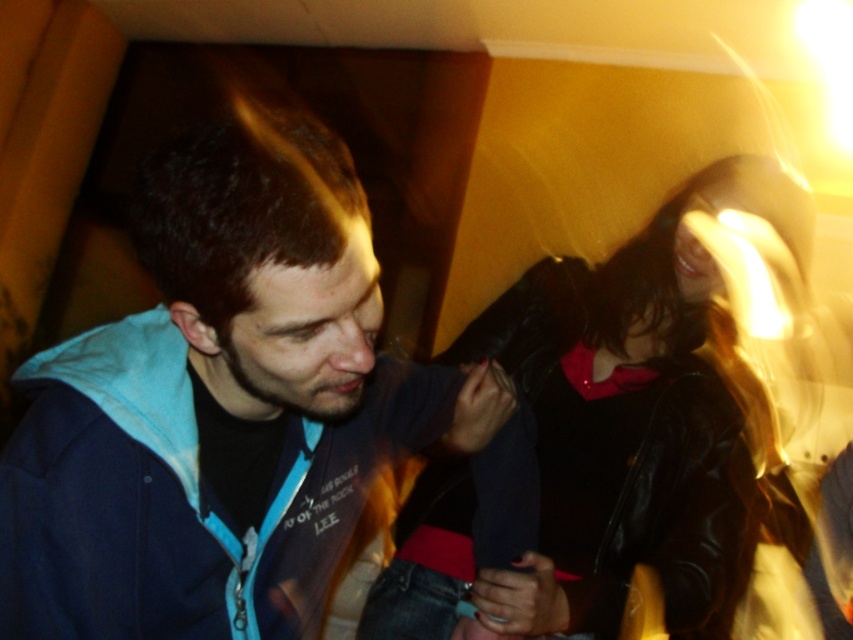
Can you confirm if blue zip-up hoodie at center is positioned to the right of shiny black jacket at center?

Incorrect, blue zip-up hoodie at center is not on the right side of shiny black jacket at center.

Can you confirm if blue zip-up hoodie at center is positioned below shiny black jacket at center?

Incorrect, blue zip-up hoodie at center is not positioned below shiny black jacket at center.

Describe the element at coordinates (233, 408) in the screenshot. The image size is (853, 640). I see `blue zip-up hoodie at center` at that location.

At what (x,y) coordinates should I click in order to perform the action: click on blue zip-up hoodie at center. Please return your answer as a coordinate pair (x, y). The image size is (853, 640). Looking at the image, I should click on (233, 408).